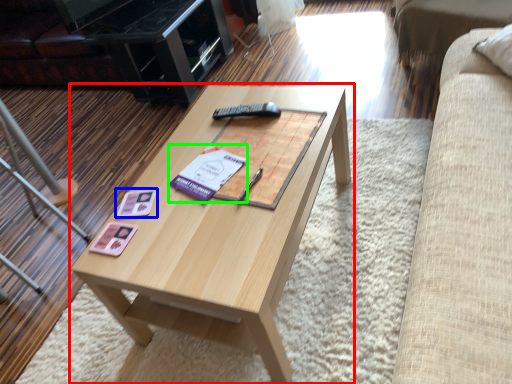
Question: Which object is positioned farthest from coffee table (highlighted by a red box)? Select from square (highlighted by a blue box) and paperback book (highlighted by a green box).

Choices:
 (A) square
 (B) paperback book

Answer: (A)